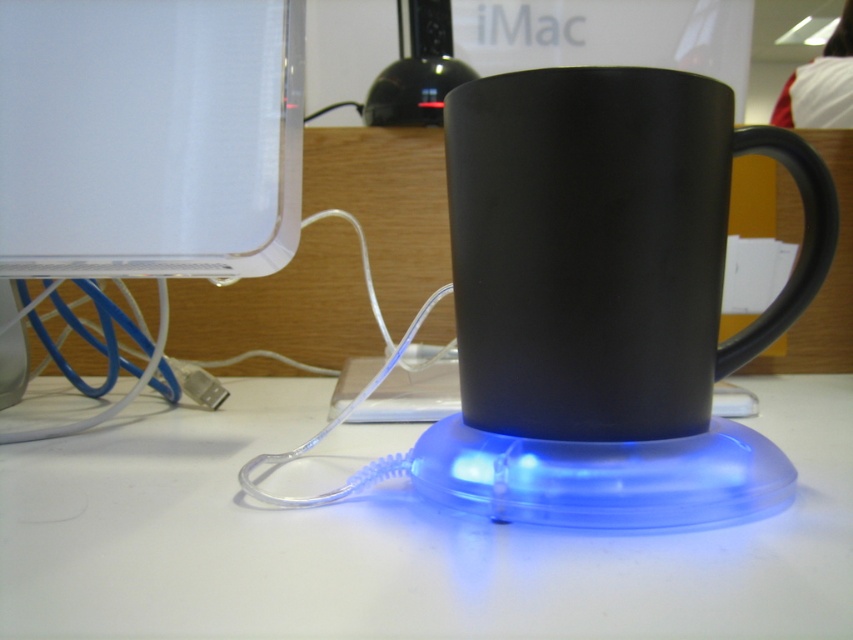
Is point (370, 529) farther from viewer compared to point (299, 140)?

No, it is not.

Between transparent plastic base at center and transparent plastic monitor at upper left, which one appears on the left side from the viewer's perspective?

transparent plastic monitor at upper left is more to the left.

Is point (503, 532) behind point (47, 35)?

No.

Identify the location of transparent plastic base at center. (393, 540).

Is transparent plastic base at center behind matte black mug at center?

That is False.

Can you confirm if transparent plastic base at center is smaller than matte black mug at center?

Incorrect, transparent plastic base at center is not smaller in size than matte black mug at center.

Between point (825, 496) and point (558, 248), which one is positioned behind?

Positioned behind is point (825, 496).

Find the location of a particular element. transparent plastic base at center is located at coordinates (393, 540).

Is matte black mug at center closer to camera compared to transparent plastic monitor at upper left?

That is True.

Who is shorter, matte black mug at center or transparent plastic monitor at upper left?

matte black mug at center

Is point (721, 145) closer to viewer compared to point (271, 228)?

Yes, point (721, 145) is in front of point (271, 228).

The height and width of the screenshot is (640, 853). I want to click on matte black mug at center, so click(x=606, y=248).